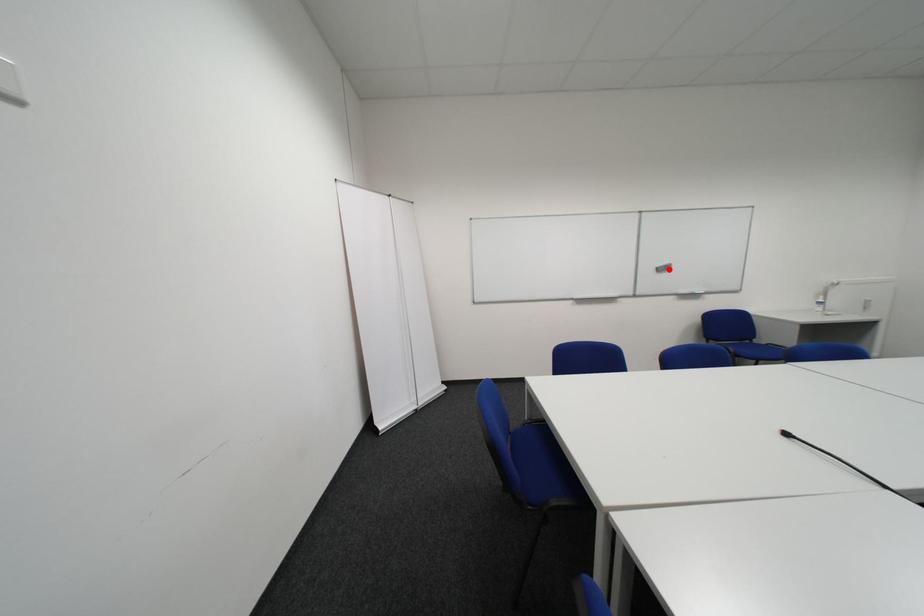
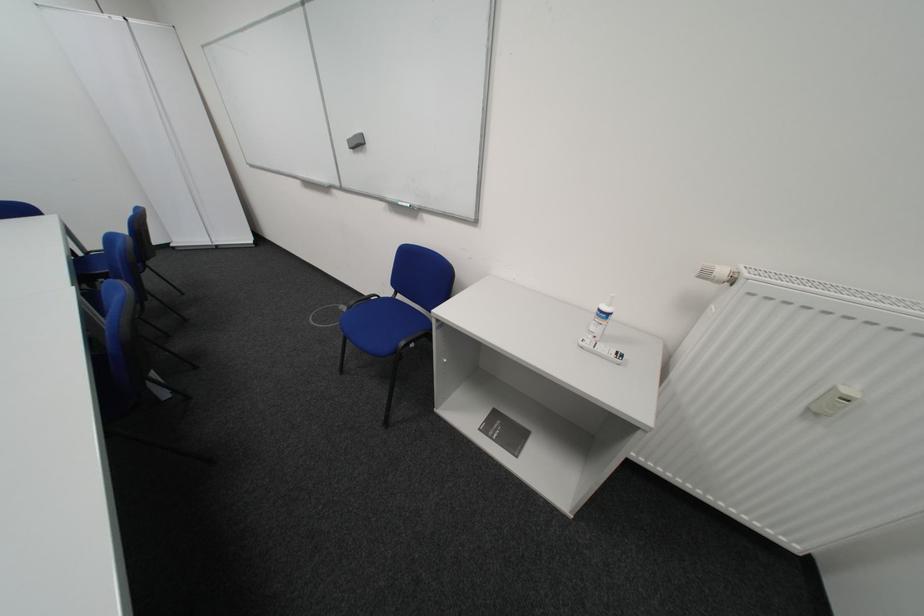
Where in the second image is the point corresponding to the highlighted location from the first image?

(361, 143)